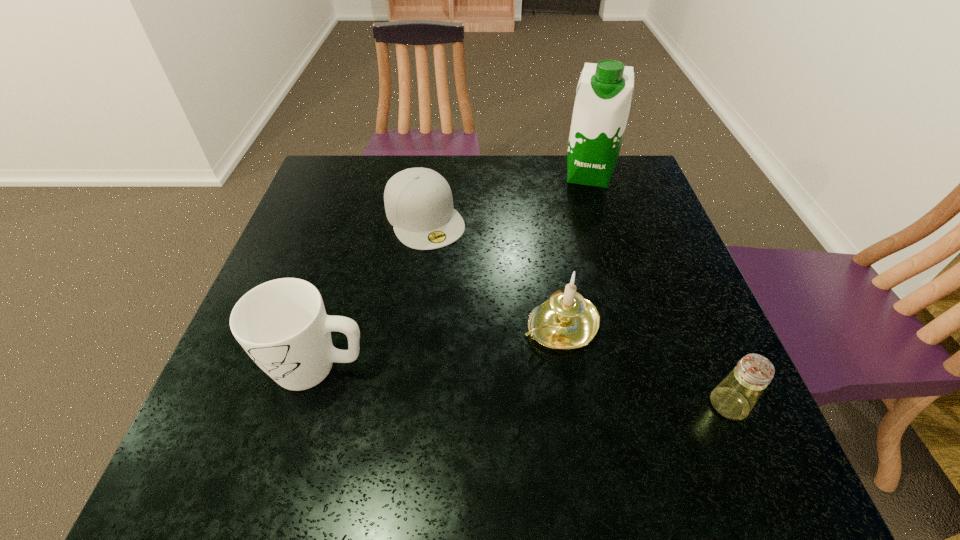
The image size is (960, 540). Identify the location of object that ranks as the third closest to the rightmost object. (282, 324).

Image resolution: width=960 pixels, height=540 pixels. Find the location of `vacant region that satisfies the following two spatial constraints: 1. on the back side of the soya milk; 2. on the right side of the candle holder`. vacant region that satisfies the following two spatial constraints: 1. on the back side of the soya milk; 2. on the right side of the candle holder is located at coordinates (537, 174).